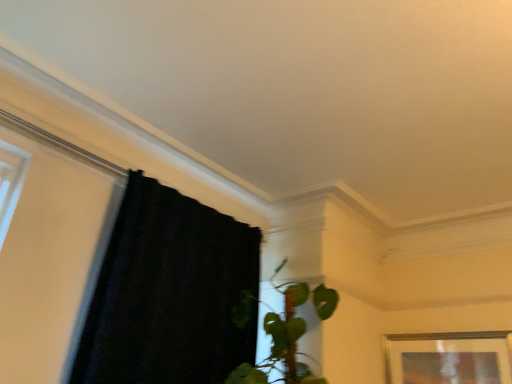
Question: From a real-world perspective, relative to black fabric curtain at left, is wooden picture frame at lower right vertically above or below?

Choices:
 (A) below
 (B) above

Answer: (A)

Question: Is wooden picture frame at lower right wider or thinner than black fabric curtain at left?

Choices:
 (A) thin
 (B) wide

Answer: (A)

Question: Is wooden picture frame at lower right bigger or smaller than black fabric curtain at left?

Choices:
 (A) small
 (B) big

Answer: (A)

Question: Considering the positions of black fabric curtain at left and wooden picture frame at lower right in the image, is black fabric curtain at left bigger or smaller than wooden picture frame at lower right?

Choices:
 (A) big
 (B) small

Answer: (A)

Question: Is black fabric curtain at left to the left or to the right of wooden picture frame at lower right in the image?

Choices:
 (A) left
 (B) right

Answer: (A)

Question: Would you say black fabric curtain at left is inside or outside wooden picture frame at lower right?

Choices:
 (A) inside
 (B) outside

Answer: (B)

Question: In terms of height, does black fabric curtain at left look taller or shorter compared to wooden picture frame at lower right?

Choices:
 (A) tall
 (B) short

Answer: (A)